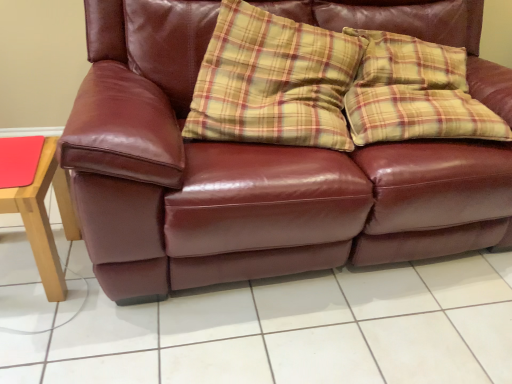
Where is `free space above matte wood table at left (from a real-world perspective)`? This screenshot has width=512, height=384. free space above matte wood table at left (from a real-world perspective) is located at coordinates (20, 160).